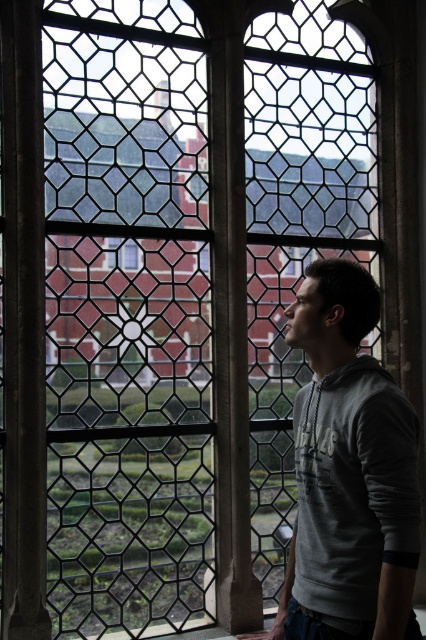
Question: Which point is closer to the camera taking this photo?

Choices:
 (A) (356, 317)
 (B) (112, 266)

Answer: (A)

Question: Which of these objects is positioned closest to the clear glass window at center?

Choices:
 (A) dark gray stone pillar at left
 (B) gray hoodie at center

Answer: (A)

Question: Is gray hoodie at center to the left of clear glass window at center from the viewer's perspective?

Choices:
 (A) no
 (B) yes

Answer: (A)

Question: Which object is farther from the camera taking this photo?

Choices:
 (A) dark gray stone pillar at left
 (B) clear glass window at center
 (C) gray hoodie at center

Answer: (B)

Question: Can you confirm if gray hoodie at center is smaller than clear glass window at center?

Choices:
 (A) no
 (B) yes

Answer: (A)

Question: Is the position of gray hoodie at center less distant than that of clear glass window at center?

Choices:
 (A) no
 (B) yes

Answer: (B)